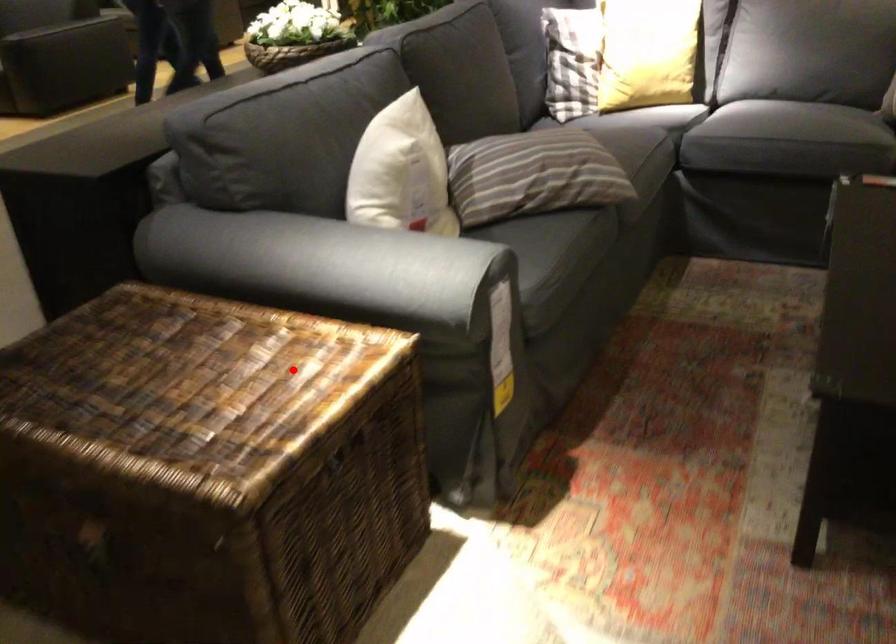
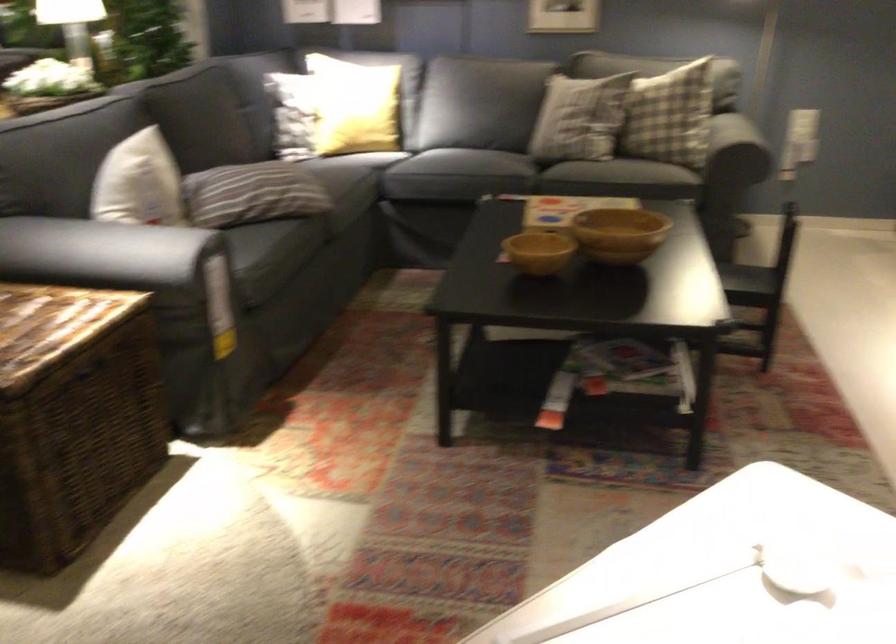
The point at the highlighted location is marked in the first image. Where is the corresponding point in the second image?

(55, 317)